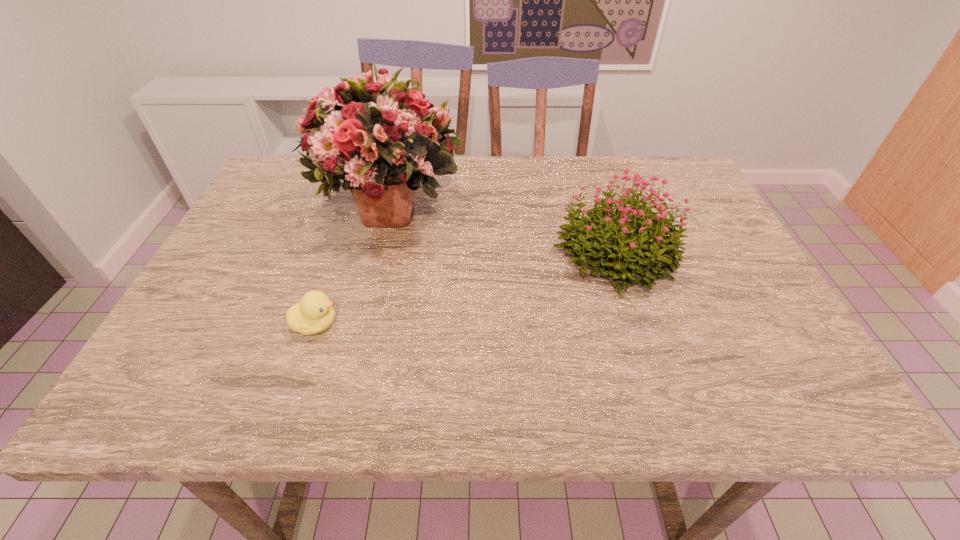
What are the coordinates of `free space that satisfies the following two spatial constraints: 1. on the front side of the shorter bouquet; 2. at the beak of the shortest object` in the screenshot? It's located at (637, 324).

Locate an element on the screen. Image resolution: width=960 pixels, height=540 pixels. free space that satisfies the following two spatial constraints: 1. on the front side of the tallest object; 2. at the beak of the shortest object is located at coordinates (361, 324).